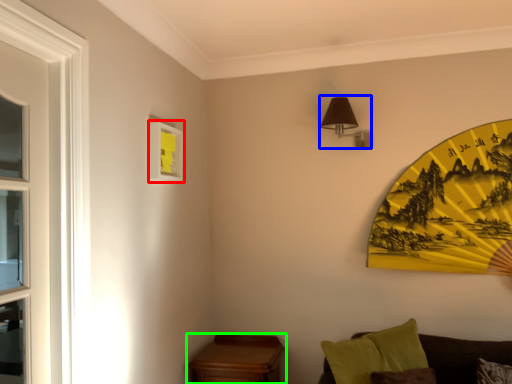
Question: Which is farther away from picture frame (highlighted by a red box)? light fixture (highlighted by a blue box) or table (highlighted by a green box)?

Choices:
 (A) light fixture
 (B) table

Answer: (B)